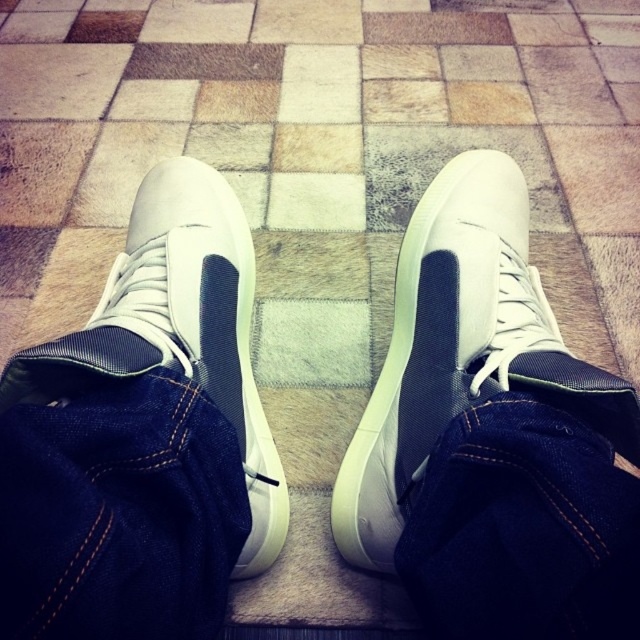
You are a photographer trying to capture the contrast between the sneakers and the floor. You notice the denim at center and dark blue denim jeans at center. Which one is closer to the camera?

The denim at center is closer to the camera than the dark blue denim jeans at center because it is in front of it.